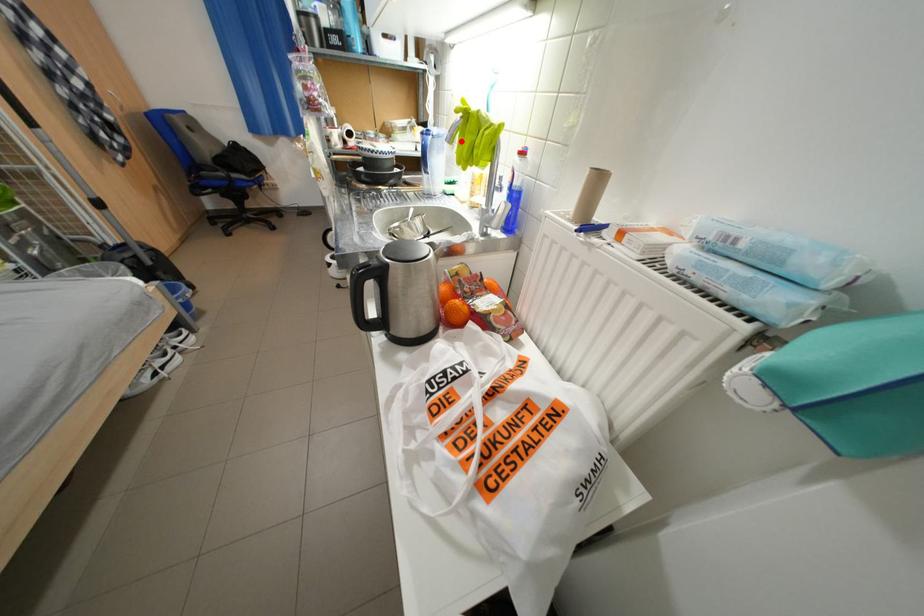
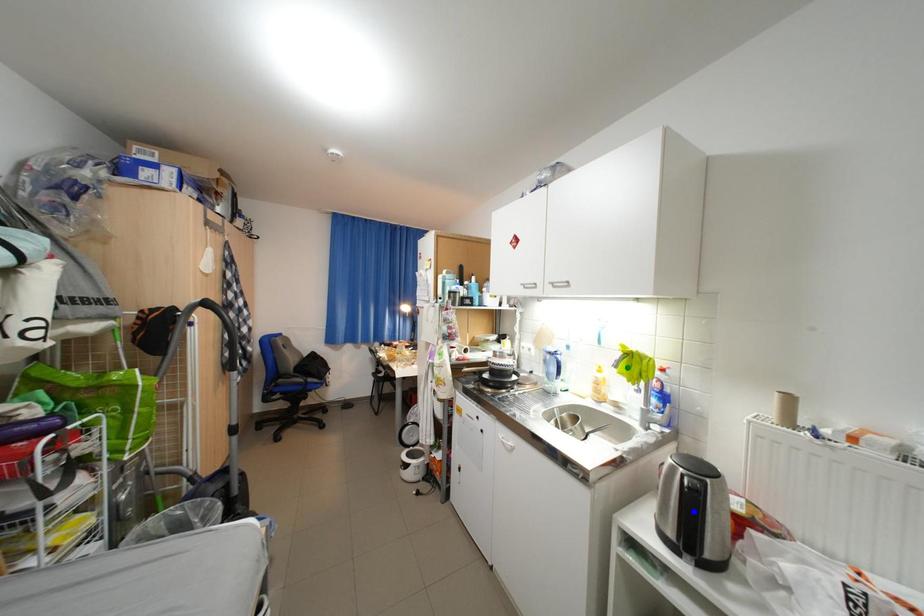
Question: I am providing you with two images of the same scene from different viewpoints. A red point is marked on the first image. You are given multiple points on the second image. Which mark in image 2 goes with the point in image 1?

Choices:
 (A) yellow point
 (B) green point
 (C) blue point

Answer: (B)